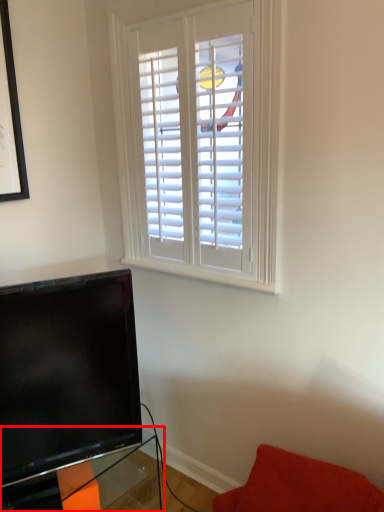
Question: From the image's perspective, what is the correct spatial relationship of table (annotated by the red box) in relation to furniture?

Choices:
 (A) below
 (B) above

Answer: (A)